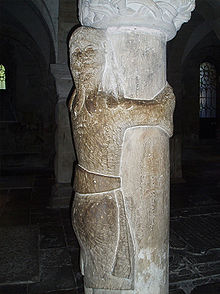
Locate an element on the screen. floor right side is located at coordinates (185, 243).